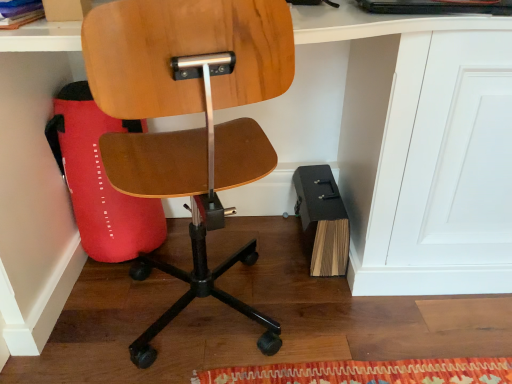
Measure the distance between wooden chair at center and camera.

67.64 centimeters.

The width and height of the screenshot is (512, 384). I want to click on wooden chair at center, so click(x=189, y=113).

Image resolution: width=512 pixels, height=384 pixels. What do you see at coordinates (189, 113) in the screenshot?
I see `wooden chair at center` at bounding box center [189, 113].

In order to click on wooden chair at center in this screenshot , I will do `click(189, 113)`.